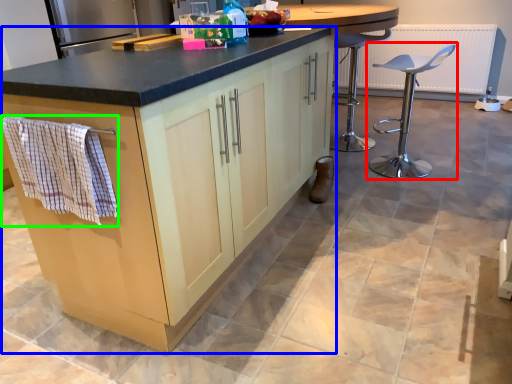
Question: Which object is the farthest from chair (highlighted by a red box)? Choose among these: cabinetry (highlighted by a blue box) or hand towel (highlighted by a green box).

Choices:
 (A) cabinetry
 (B) hand towel

Answer: (B)